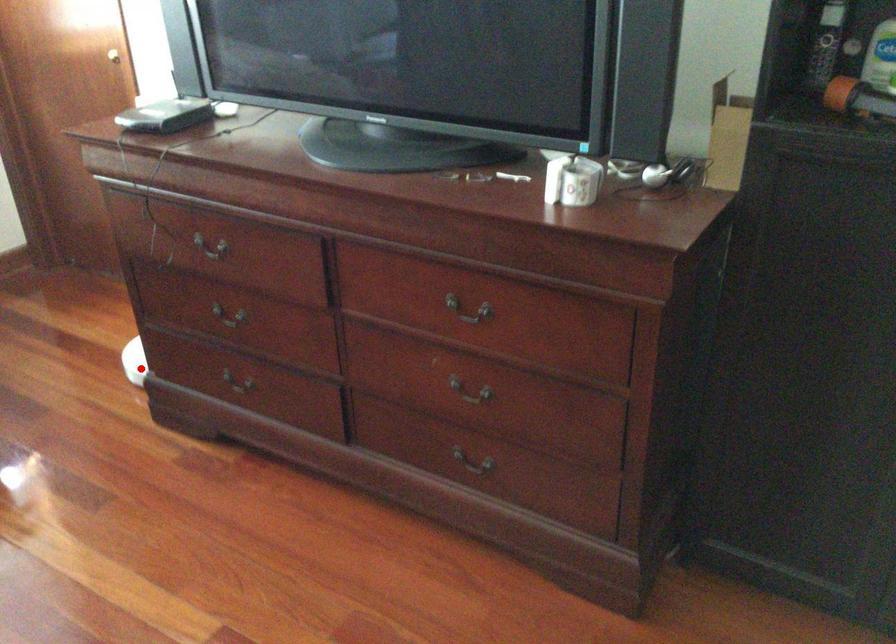
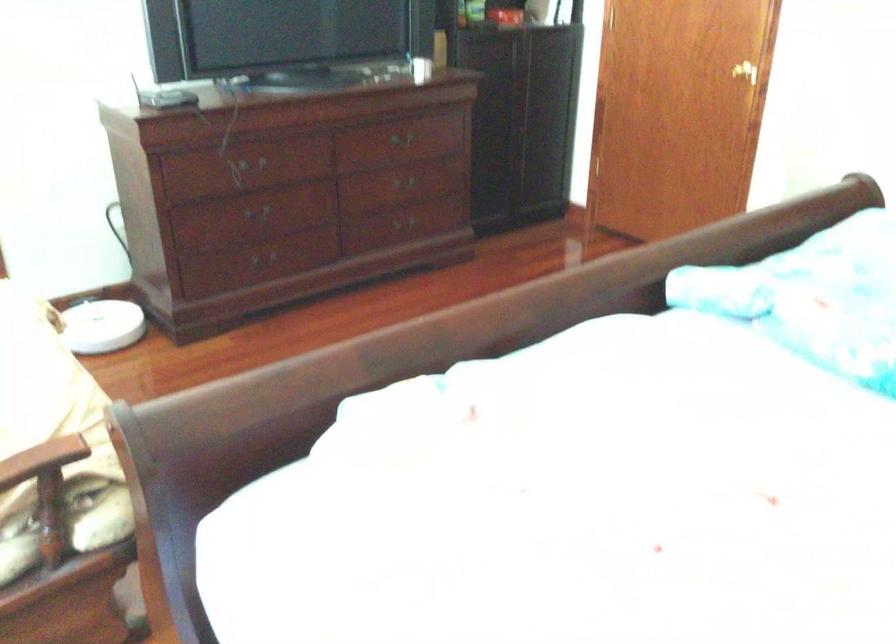
Question: I am providing you with two images of the same scene from different viewpoints. Image1 has a red point marked. In image2, the corresponding 3D location appears at what relative position? Reply with the corresponding letter.

Choices:
 (A) Closer
 (B) Farther

Answer: (B)